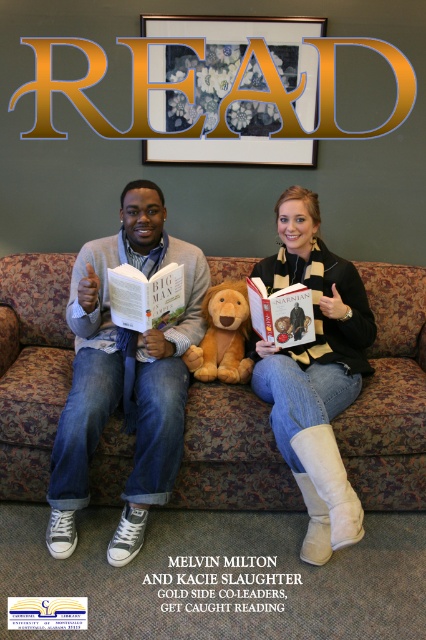
From the picture: You are standing in front of the couch and want to place a pencil case between the white suede boots at lower right and the white paper at center. Which object should you place it closer to if you want the pencil case to be near the thinner object?

You should place the pencil case closer to the white suede boots at lower right because it is thinner than the white paper at center.

Based on the photo, you are a delivery person who needs to place a small package between the white paper at center and the hardcover book at center. The package is 10 centimeters wide. Can you fit it between them?

The white paper at center and hardcover book at center are 89.24 centimeters apart, so yes, the package can fit between them since the distance is much larger than the package width.

You are standing in front of the couch and want to place a small decoration exactly at the point marked as point [124,376]. Which object on the couch should you place it on?

The point [124,376] is on the matte gray sweater at center, so you should place the decoration on the matte gray sweater at center.